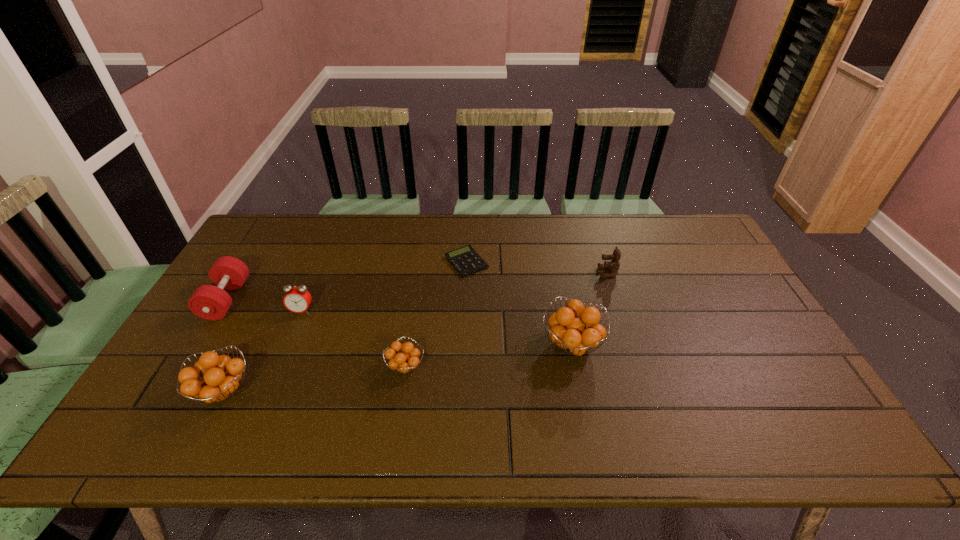
This screenshot has height=540, width=960. What are the coordinates of `vacant region that satisfies the following two spatial constraints: 1. on the front-facing side of the rightmost orange fruit; 2. on the left side of the alarm clock` in the screenshot? It's located at (288, 345).

Image resolution: width=960 pixels, height=540 pixels. I want to click on free space that satisfies the following two spatial constraints: 1. on the face of the teddy bear; 2. on the front side of the dumbbell, so click(x=616, y=300).